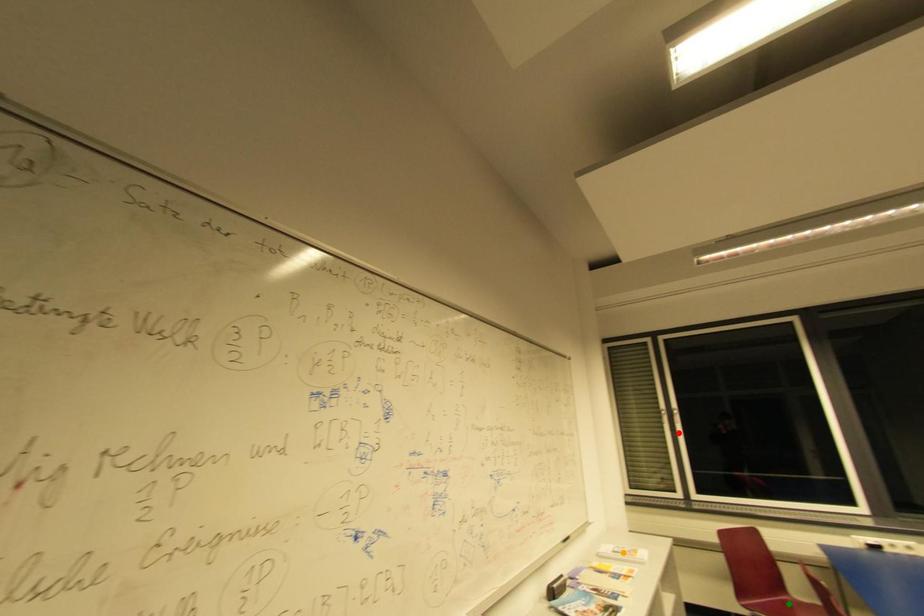
Order these from nearest to farthest:
1. red point
2. orange point
3. green point

1. green point
2. orange point
3. red point